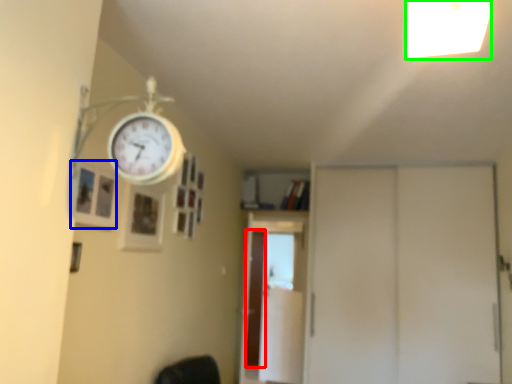
Question: Considering the real-world distances, which object is closest to screen door (highlighted by a red box)? picture frame (highlighted by a blue box) or light fixture (highlighted by a green box).

Choices:
 (A) picture frame
 (B) light fixture

Answer: (A)